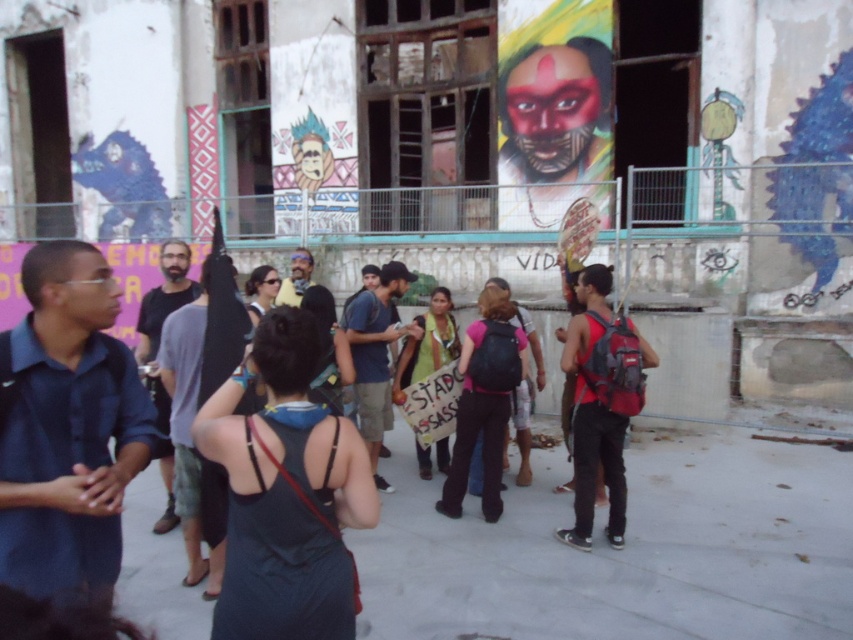
Is point (74, 266) behind point (624, 516)?

No, (74, 266) is closer to viewer.

Between dark blue shirt at left and red backpack at center, which one appears on the left side from the viewer's perspective?

From the viewer's perspective, dark blue shirt at left appears more on the left side.

The width and height of the screenshot is (853, 640). Identify the location of dark blue shirt at left. (67, 428).

Can you confirm if red backpack at center is taller than pink fabric backpack at center?

Yes, red backpack at center is taller than pink fabric backpack at center.

Can you confirm if red backpack at center is thinner than pink fabric backpack at center?

Correct, red backpack at center's width is less than pink fabric backpack at center's.

The height and width of the screenshot is (640, 853). What do you see at coordinates (601, 403) in the screenshot?
I see `red backpack at center` at bounding box center [601, 403].

Identify the location of red backpack at center. This screenshot has width=853, height=640. (601, 403).

Is pink fabric backpack at center thinner than matte black sign at center?

In fact, pink fabric backpack at center might be wider than matte black sign at center.

Which is in front, point (506, 369) or point (421, 324)?

Point (506, 369) is in front.

Does point (463, 360) lie behind point (447, 440)?

No, (463, 360) is closer to viewer.

The height and width of the screenshot is (640, 853). Find the location of `pink fabric backpack at center`. pink fabric backpack at center is located at coordinates (485, 401).